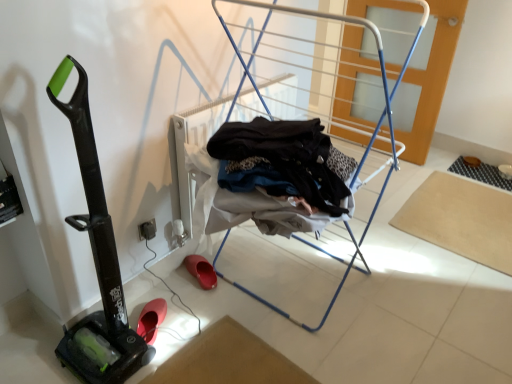
Image resolution: width=512 pixels, height=384 pixels. I want to click on vacant space that is to the left of rubber/matte clog at lower left, which is the first footwear in right-to-left order, so click(175, 277).